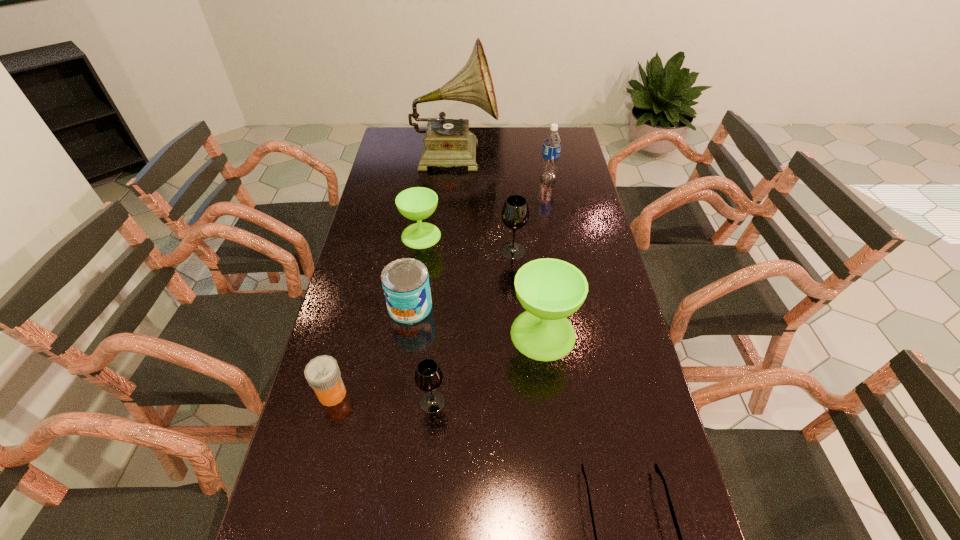
Where is `the farthest object`? the farthest object is located at coordinates click(448, 142).

Find the location of a particular element. This screenshot has width=960, height=540. record player is located at coordinates (448, 142).

I want to click on water bottle, so click(552, 142).

This screenshot has height=540, width=960. Identify the location of the farther gray wineglass. (515, 214).

This screenshot has width=960, height=540. Identify the location of the bigger gray wineglass. (515, 214).

This screenshot has height=540, width=960. Find the location of `the nearer green wineglass`. the nearer green wineglass is located at coordinates tap(550, 290).

Identify the location of the third farthest wineglass. (550, 290).

Where is `the left green wineglass`? The width and height of the screenshot is (960, 540). the left green wineglass is located at coordinates (417, 203).

Find the location of a particular element. Image resolution: width=960 pixels, height=540 pixels. the smaller green wineglass is located at coordinates (417, 203).

In order to click on the left gray wineglass in this screenshot , I will do `click(428, 376)`.